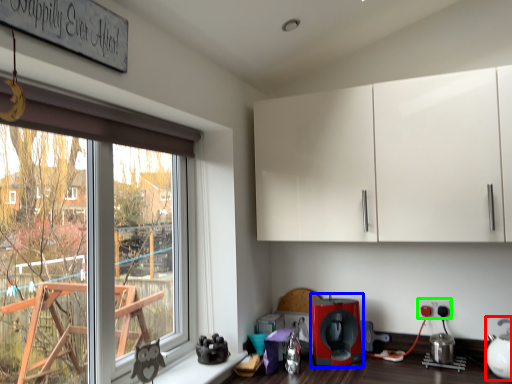
Question: Which object is positioned farthest from tea pot (highlighted by a red box)? Select from coffee machine (highlighted by a blue box) and electric outlet (highlighted by a green box).

Choices:
 (A) coffee machine
 (B) electric outlet

Answer: (A)